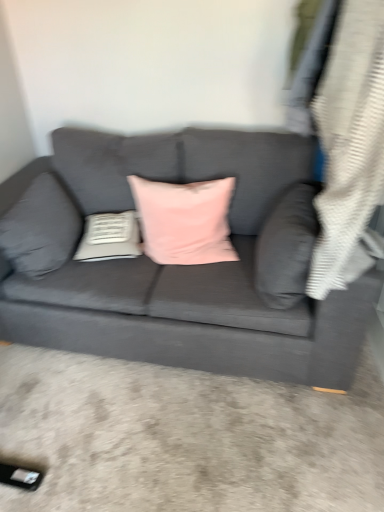
Question: Which direction should I rotate to look at white textured pillow at center, the 3th pillow viewed from the right, — up or down?

Choices:
 (A) down
 (B) up

Answer: (B)

Question: Are matte gray couch at center and matte gray pillow at right, which is counted as the 1th pillow, starting from the right, located far from each other?

Choices:
 (A) yes
 (B) no

Answer: (B)

Question: Is matte gray couch at center touching matte gray pillow at right, which is counted as the 1th pillow, starting from the right?

Choices:
 (A) no
 (B) yes

Answer: (A)

Question: Is matte gray couch at center taller than matte gray pillow at right, which is counted as the 1th pillow, starting from the right?

Choices:
 (A) no
 (B) yes

Answer: (B)

Question: Does matte gray couch at center have a greater width compared to matte gray pillow at right, the fourth pillow when ordered from left to right?

Choices:
 (A) yes
 (B) no

Answer: (A)

Question: Can you confirm if matte gray couch at center is positioned to the left of matte gray pillow at right, the fourth pillow when ordered from left to right?

Choices:
 (A) no
 (B) yes

Answer: (B)

Question: From a real-world perspective, is matte gray couch at center under matte gray pillow at right, the fourth pillow when ordered from left to right?

Choices:
 (A) yes
 (B) no

Answer: (A)

Question: Considering the relative positions of matte gray couch at center and matte gray pillow at left, the 4th pillow when ordered from right to left, in the image provided, is matte gray couch at center to the right of matte gray pillow at left, the 4th pillow when ordered from right to left, from the viewer's perspective?

Choices:
 (A) yes
 (B) no

Answer: (A)

Question: Is matte gray couch at center smaller than matte gray pillow at left, the 4th pillow when ordered from right to left?

Choices:
 (A) no
 (B) yes

Answer: (A)

Question: Does matte gray couch at center have a greater height compared to matte gray pillow at left, marked as the 1th pillow in a left-to-right arrangement?

Choices:
 (A) yes
 (B) no

Answer: (A)

Question: Can you confirm if matte gray couch at center is thinner than matte gray pillow at left, marked as the 1th pillow in a left-to-right arrangement?

Choices:
 (A) no
 (B) yes

Answer: (A)

Question: From the image's perspective, does matte gray couch at center appear lower than matte gray pillow at left, the 4th pillow when ordered from right to left?

Choices:
 (A) yes
 (B) no

Answer: (A)

Question: Is matte gray couch at center not close to matte gray pillow at left, the 4th pillow when ordered from right to left?

Choices:
 (A) no
 (B) yes

Answer: (A)

Question: Considering the relative sizes of matte gray couch at center and white textured pillow at center, the 3th pillow viewed from the right, in the image provided, is matte gray couch at center smaller than white textured pillow at center, the 3th pillow viewed from the right,?

Choices:
 (A) no
 (B) yes

Answer: (A)